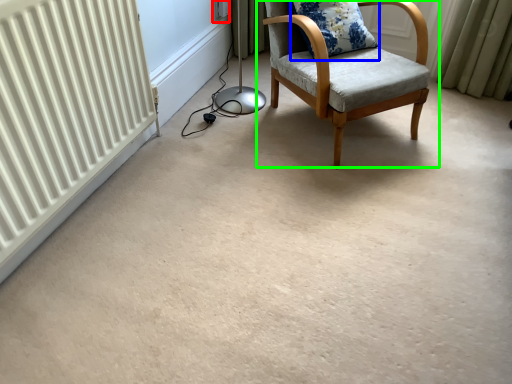
Question: Considering the real-world distances, which object is closest to electric outlet (highlighted by a red box)? pillow (highlighted by a blue box) or chair (highlighted by a green box).

Choices:
 (A) pillow
 (B) chair

Answer: (A)